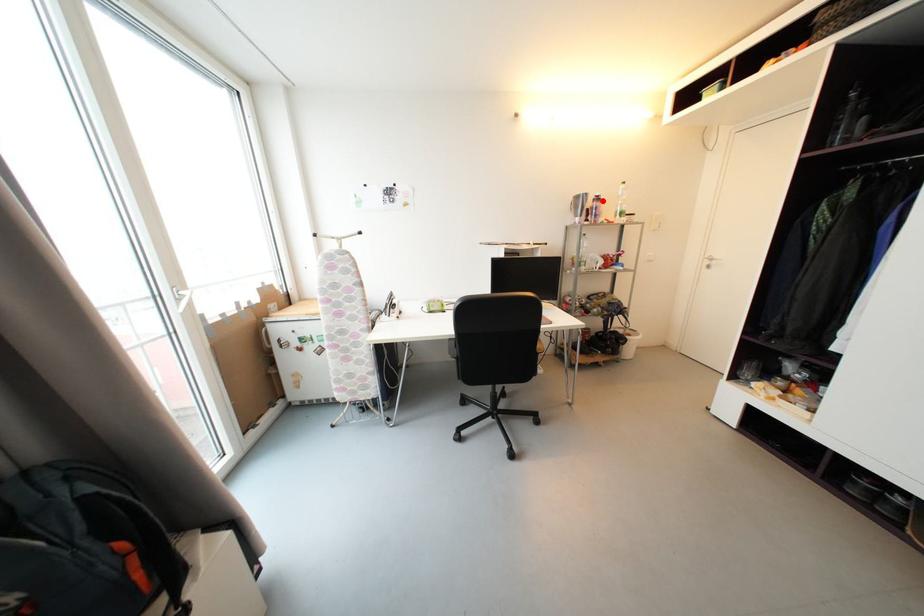
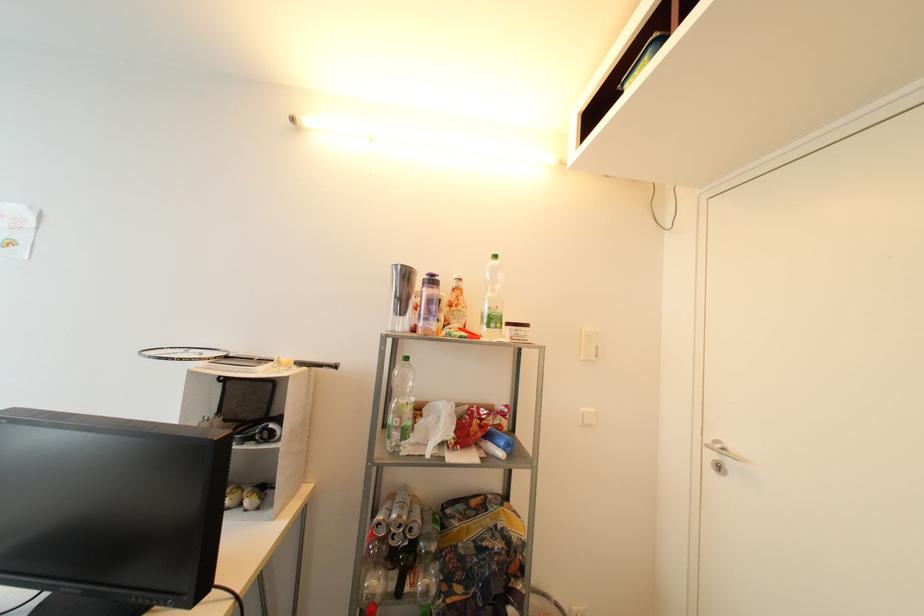
Find the pixel in the second image that matches the highlighted location in the first image.

(438, 283)